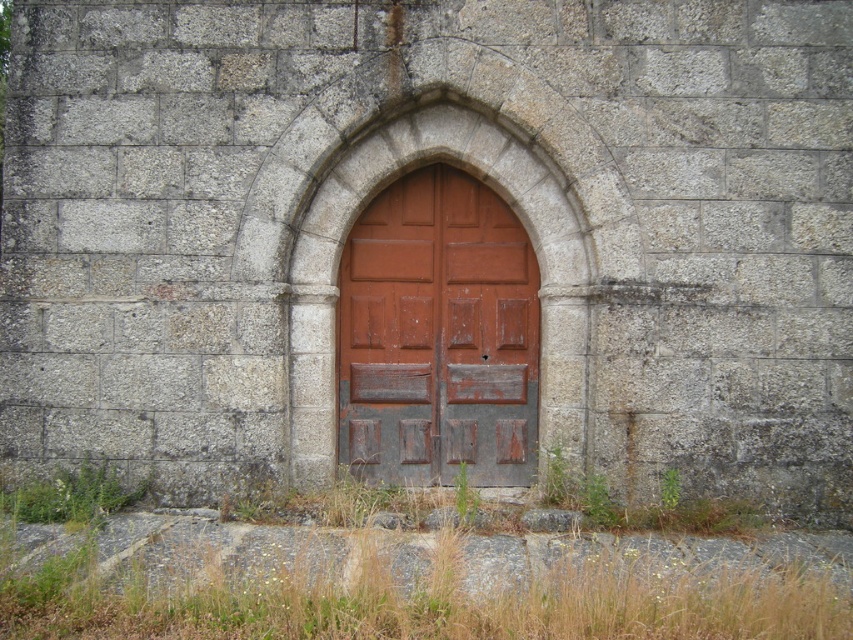
Is rustic wood door at center below green grassy weed at lower left?

No.

Which is more to the left, rustic wood door at center or green grassy weed at lower left?

green grassy weed at lower left is more to the left.

Is point (386, 273) positioned behind point (111, 477)?

Yes, point (386, 273) is behind point (111, 477).

At what (x,y) coordinates should I click in order to perform the action: click on rustic wood door at center. Please return your answer as a coordinate pair (x, y). Looking at the image, I should click on (438, 337).

Is point (61, 483) closer to viewer compared to point (466, 504)?

No, (61, 483) is behind (466, 504).

Between point (109, 470) and point (463, 500), which one is positioned in front?

Point (463, 500) is more forward.

Where is `green grassy weed at lower left`? This screenshot has width=853, height=640. green grassy weed at lower left is located at coordinates tap(68, 493).

Identify the location of rustic wood door at center. The height and width of the screenshot is (640, 853). (438, 337).

Which is more to the right, rustic wood door at center or green leafy weed at lower right?

Positioned to the right is green leafy weed at lower right.

Does point (361, 444) lie in front of point (679, 484)?

No, (361, 444) is behind (679, 484).

This screenshot has width=853, height=640. I want to click on rustic wood door at center, so click(438, 337).